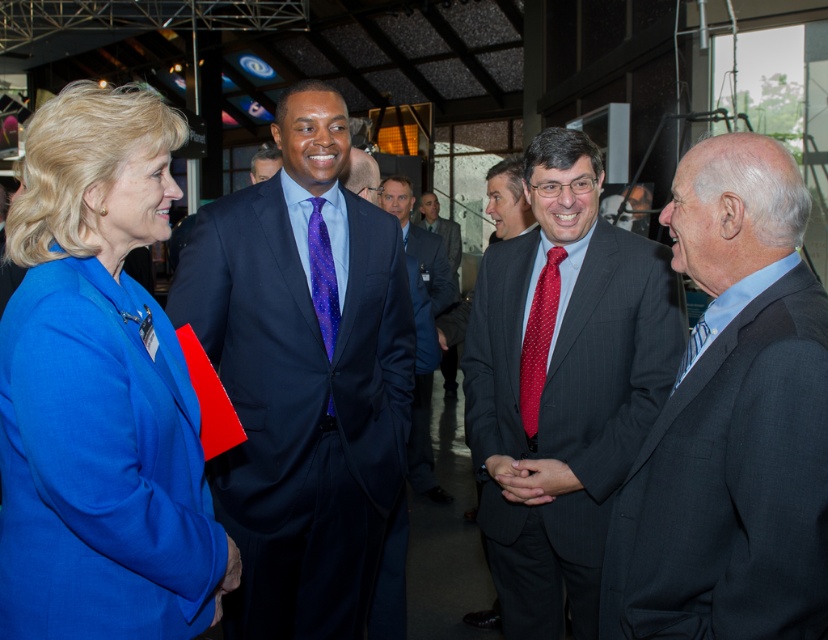
Question: Which of the following is the closest to the observer?

Choices:
 (A) matte black suit at center
 (B) matte blue suit at center
 (C) dark blue suit at center

Answer: (B)

Question: From the image, what is the correct spatial relationship of matte blue blazer at center in relation to dark gray pinstripe suit at center?

Choices:
 (A) below
 (B) above

Answer: (B)

Question: Among these points, which one is nearest to the camera?

Choices:
 (A) (446, 268)
 (B) (549, 333)
 (C) (32, 260)

Answer: (C)

Question: Is matte blue suit at center positioned at the back of matte black suit at center?

Choices:
 (A) no
 (B) yes

Answer: (A)

Question: Among these objects, which one is nearest to the camera?

Choices:
 (A) matte blue suit at center
 (B) dark gray pinstripe suit at center

Answer: (B)

Question: From the image, what is the correct spatial relationship of matte blue blazer at center in relation to dark gray suit at right?

Choices:
 (A) left
 (B) right

Answer: (A)